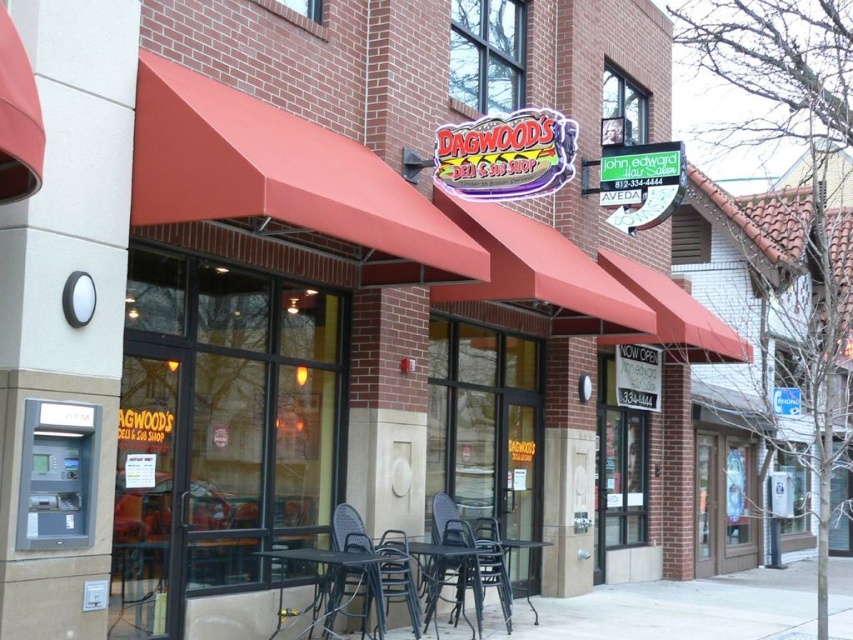
Which of these two, black plastic chair at center or rattan chair at lower center, stands shorter?

rattan chair at lower center

Describe the element at coordinates (467, 561) in the screenshot. The width and height of the screenshot is (853, 640). I see `black plastic chair at center` at that location.

Image resolution: width=853 pixels, height=640 pixels. I want to click on black plastic chair at center, so tap(467, 561).

Which is in front, point (334, 554) or point (506, 570)?

Positioned in front is point (334, 554).

In the scene shown: Does black metal table at lower center lie in front of metallic black table at lower center?

That is True.

Is point (369, 573) farther from viewer compared to point (527, 545)?

No.

This screenshot has width=853, height=640. I want to click on black metal table at lower center, so click(x=332, y=586).

Can you confirm if black plastic chair at center is thinner than metallic black table at lower center?

In fact, black plastic chair at center might be wider than metallic black table at lower center.

Does black plastic chair at center have a larger size compared to metallic black table at lower center?

Yes.

Describe the element at coordinates (467, 561) in the screenshot. This screenshot has width=853, height=640. I see `black plastic chair at center` at that location.

Identify the location of black plastic chair at center. This screenshot has height=640, width=853. (467, 561).